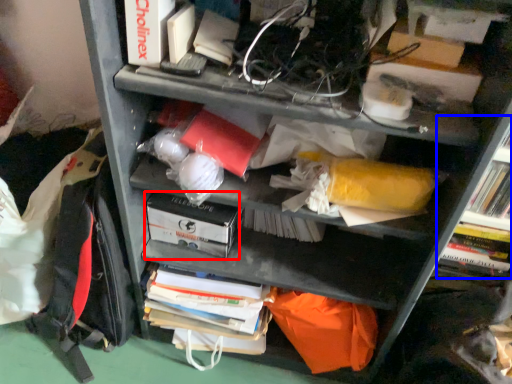
Question: Which of the following is the closest to the observer, paperback book (highlighted by a red box) or shelf (highlighted by a blue box)?

Choices:
 (A) paperback book
 (B) shelf

Answer: (B)